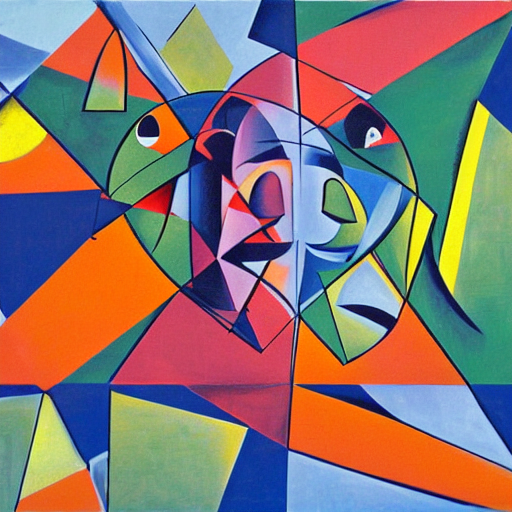
This screenshot has height=512, width=512. In order to click on corner in this screenshot , I will do `click(497, 498)`, `click(15, 499)`, `click(11, 28)`, `click(501, 10)`.